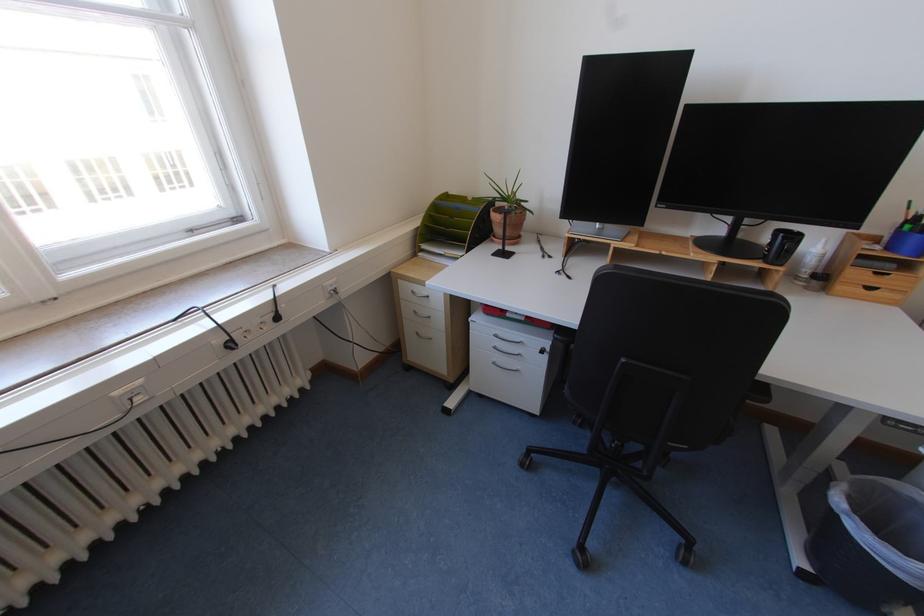
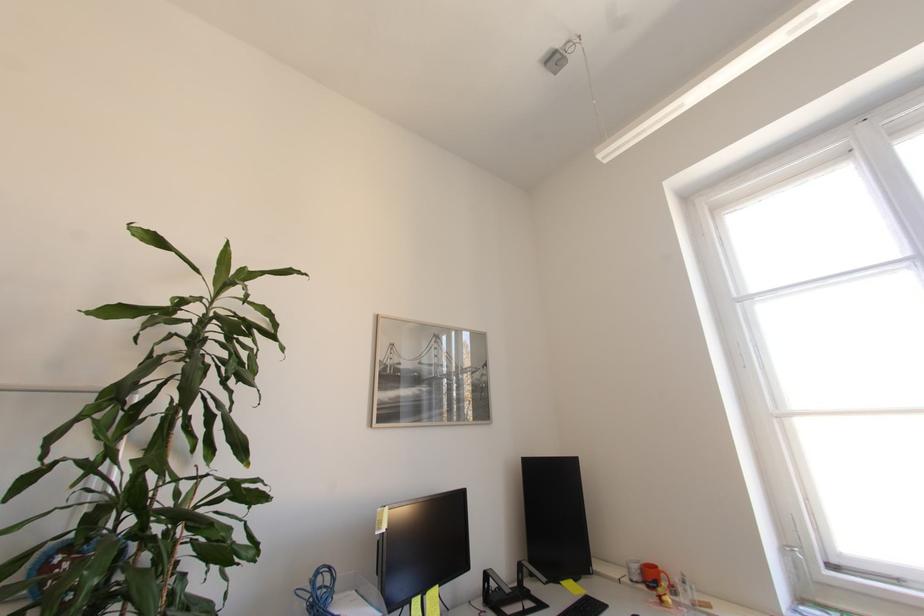
Question: The camera is either moving clockwise (left) or counter-clockwise (right) around the object. The first image is from the beginning of the video and the second image is from the end. Is the camera moving left or right when shooting the video?

Choices:
 (A) Left
 (B) Right

Answer: (B)